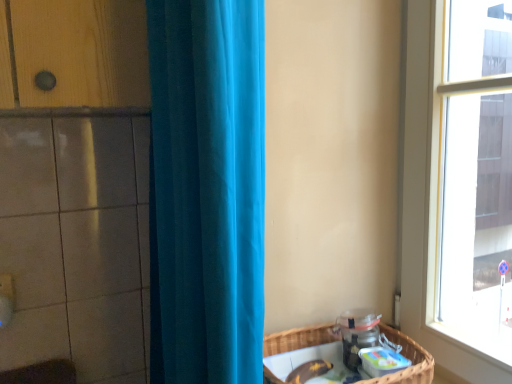
Question: Considering the relative sizes of teal fabric curtain at center and woven brown basket at lower right in the image provided, is teal fabric curtain at center wider than woven brown basket at lower right?

Choices:
 (A) no
 (B) yes

Answer: (A)

Question: From a real-world perspective, does teal fabric curtain at center stand above woven brown basket at lower right?

Choices:
 (A) yes
 (B) no

Answer: (A)

Question: Considering the relative sizes of teal fabric curtain at center and woven brown basket at lower right in the image provided, is teal fabric curtain at center taller than woven brown basket at lower right?

Choices:
 (A) yes
 (B) no

Answer: (A)

Question: Would you say woven brown basket at lower right is part of teal fabric curtain at center's contents?

Choices:
 (A) no
 (B) yes

Answer: (A)

Question: Is teal fabric curtain at center at the left side of woven brown basket at lower right?

Choices:
 (A) yes
 (B) no

Answer: (A)

Question: Is the depth of teal fabric curtain at center less than that of woven brown basket at lower right?

Choices:
 (A) yes
 (B) no

Answer: (A)

Question: Does woven brown basket at lower right have a greater height compared to teal fabric curtain at center?

Choices:
 (A) yes
 (B) no

Answer: (B)

Question: Considering the relative sizes of woven brown basket at lower right and teal fabric curtain at center in the image provided, is woven brown basket at lower right shorter than teal fabric curtain at center?

Choices:
 (A) yes
 (B) no

Answer: (A)

Question: Considering the relative positions of woven brown basket at lower right and teal fabric curtain at center in the image provided, is woven brown basket at lower right in front of teal fabric curtain at center?

Choices:
 (A) no
 (B) yes

Answer: (A)

Question: From a real-world perspective, does woven brown basket at lower right sit lower than teal fabric curtain at center?

Choices:
 (A) yes
 (B) no

Answer: (A)

Question: Would you consider woven brown basket at lower right to be distant from teal fabric curtain at center?

Choices:
 (A) yes
 (B) no

Answer: (B)

Question: Is woven brown basket at lower right positioned with its back to teal fabric curtain at center?

Choices:
 (A) yes
 (B) no

Answer: (B)

Question: From the image's perspective, relative to woven brown basket at lower right, is teal fabric curtain at center above or below?

Choices:
 (A) above
 (B) below

Answer: (A)